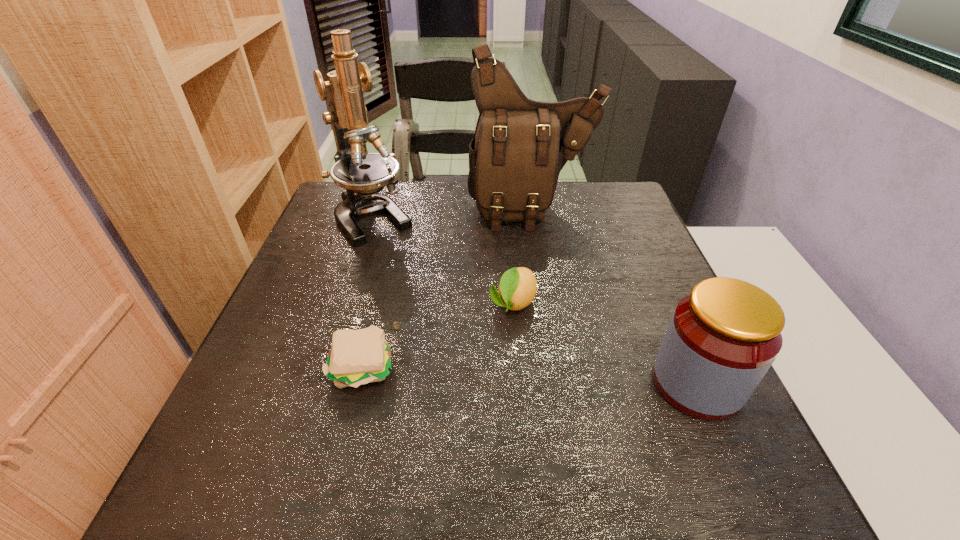
The width and height of the screenshot is (960, 540). I want to click on free spot located 0.130m at the eyepiece of the microscope, so click(x=412, y=269).

Where is `free space located 0.250m on the front-facing side of the shoulder bag`? free space located 0.250m on the front-facing side of the shoulder bag is located at coordinates pos(555,298).

Find the location of a particular element. free region located 0.350m on the front-facing side of the shoulder bag is located at coordinates (563, 330).

Where is `free region located on the front-facing side of the shoulder bag`? Image resolution: width=960 pixels, height=540 pixels. free region located on the front-facing side of the shoulder bag is located at coordinates (543, 249).

Image resolution: width=960 pixels, height=540 pixels. Find the location of `vacant space located with leaves positioned above the third farthest object`. vacant space located with leaves positioned above the third farthest object is located at coordinates (468, 399).

Locate an element on the screen. Image resolution: width=960 pixels, height=540 pixels. free space located with leaves positioned above the third farthest object is located at coordinates coord(471,390).

The image size is (960, 540). I want to click on vacant space located with leaves positioned above the third farthest object, so click(463, 408).

At what (x,y) coordinates should I click in order to perform the action: click on microscope positioned at the far edge. Please return your answer as a coordinate pair (x, y). The image size is (960, 540). Looking at the image, I should click on [x=363, y=175].

Find the location of a particular element. shoulder bag at the far edge is located at coordinates tap(520, 146).

This screenshot has height=540, width=960. I want to click on patty that is positioned at the near edge, so click(357, 357).